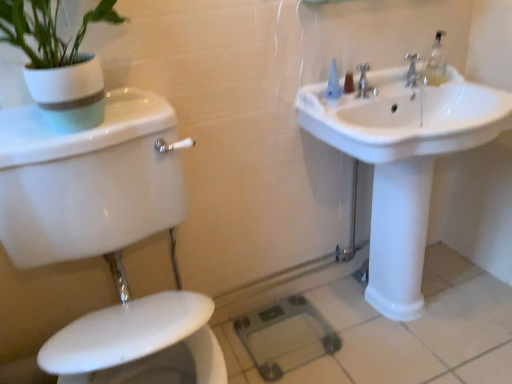
Locate an element on the screen. The height and width of the screenshot is (384, 512). vacant area situated below white glossy sink at upper right (from a real-world perspective) is located at coordinates (409, 322).